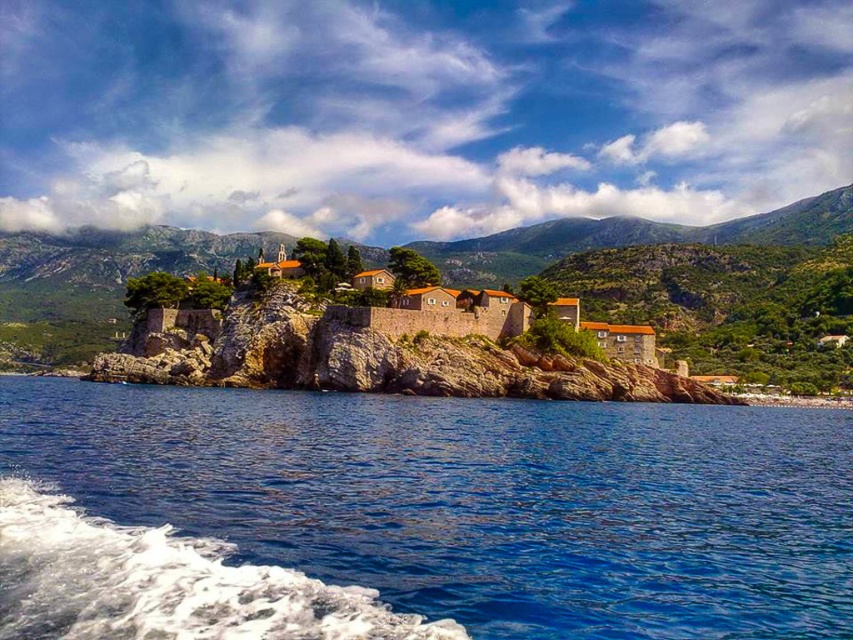
Does blue liquid water at lower left have a greater height compared to brown stone mountain at center?

Incorrect, blue liquid water at lower left's height is not larger of brown stone mountain at center's.

Which is more to the right, blue liquid water at lower left or brown stone mountain at center?

blue liquid water at lower left is more to the right.

Describe the element at coordinates (415, 516) in the screenshot. The height and width of the screenshot is (640, 853). I see `blue liquid water at lower left` at that location.

I want to click on blue liquid water at lower left, so click(x=415, y=516).